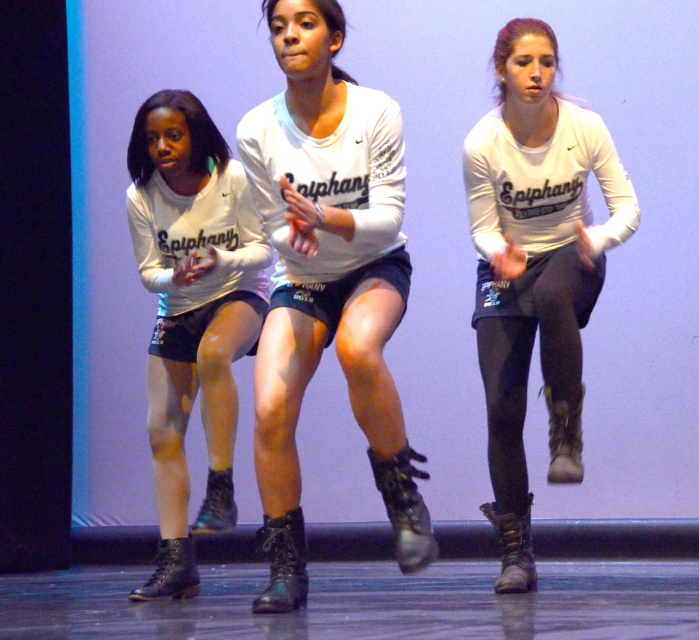
Question: Where is matte white shirt at center located in relation to matte black boots at center in the image?

Choices:
 (A) left
 (B) right

Answer: (B)

Question: Which point is closer to the camera taking this photo?

Choices:
 (A) (419, 554)
 (B) (238, 180)

Answer: (A)

Question: Which point is farther to the camera?

Choices:
 (A) matte white shirt at center
 (B) matte black shorts at center
 (C) matte black boots at center

Answer: (C)

Question: Can you confirm if matte black shorts at center is positioned below matte black boots at center?

Choices:
 (A) yes
 (B) no

Answer: (B)

Question: Does matte black shorts at center have a larger size compared to matte black boots at center?

Choices:
 (A) yes
 (B) no

Answer: (A)

Question: Which point is closer to the camera taking this photo?

Choices:
 (A) [505, 323]
 (B) [219, 257]
 (C) [289, 307]

Answer: (C)